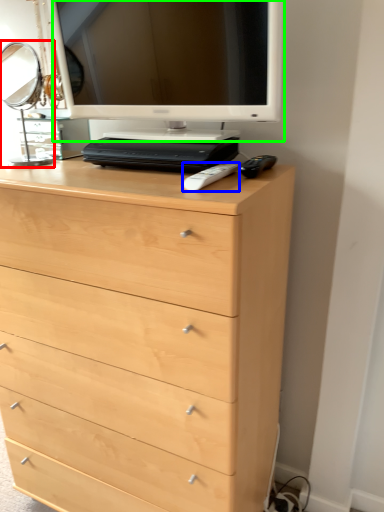
Question: Which object is the closest to the table lamp (highlighted by a red box)? Choose among these: remote (highlighted by a blue box) or computer monitor (highlighted by a green box).

Choices:
 (A) remote
 (B) computer monitor

Answer: (B)